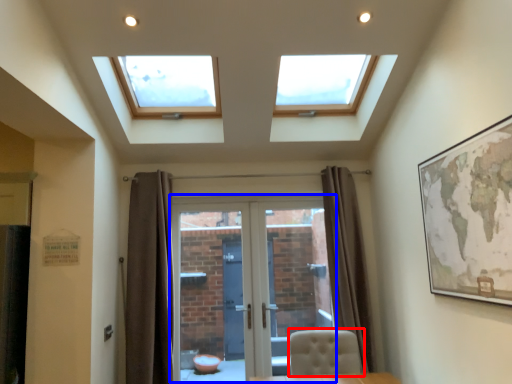
Question: Which object is further to the camera taking this photo, chair (highlighted by a red box) or door (highlighted by a blue box)?

Choices:
 (A) chair
 (B) door

Answer: (B)